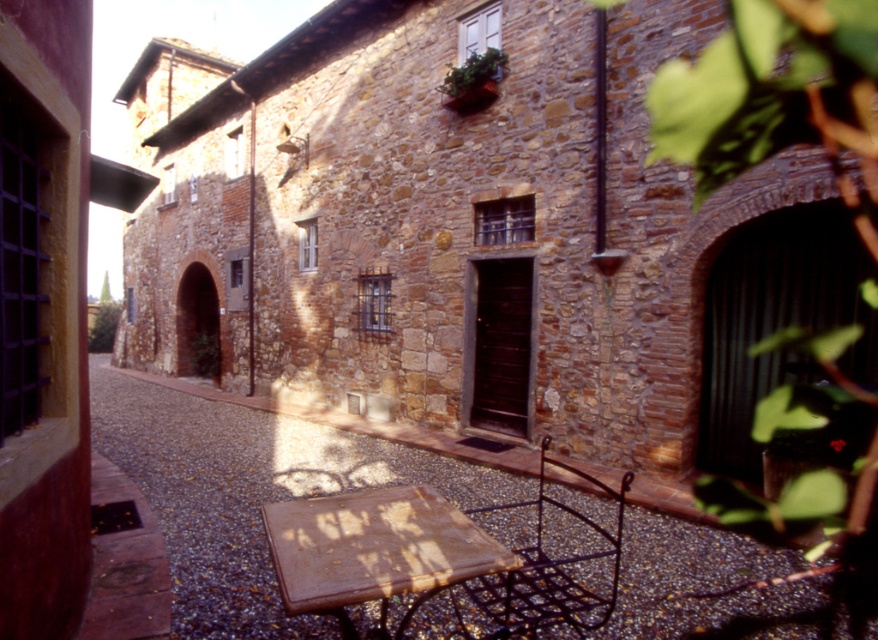
Question: Among these objects, which one is nearest to the camera?

Choices:
 (A) rusty metal table at lower center
 (B) black wrought iron chair at lower right

Answer: (A)

Question: Does rusty metal table at lower center have a smaller size compared to black wrought iron chair at lower right?

Choices:
 (A) yes
 (B) no

Answer: (A)

Question: Can you confirm if rusty metal table at lower center is positioned to the right of black wrought iron chair at lower right?

Choices:
 (A) yes
 (B) no

Answer: (B)

Question: Does rusty metal table at lower center have a greater width compared to black wrought iron chair at lower right?

Choices:
 (A) no
 (B) yes

Answer: (A)